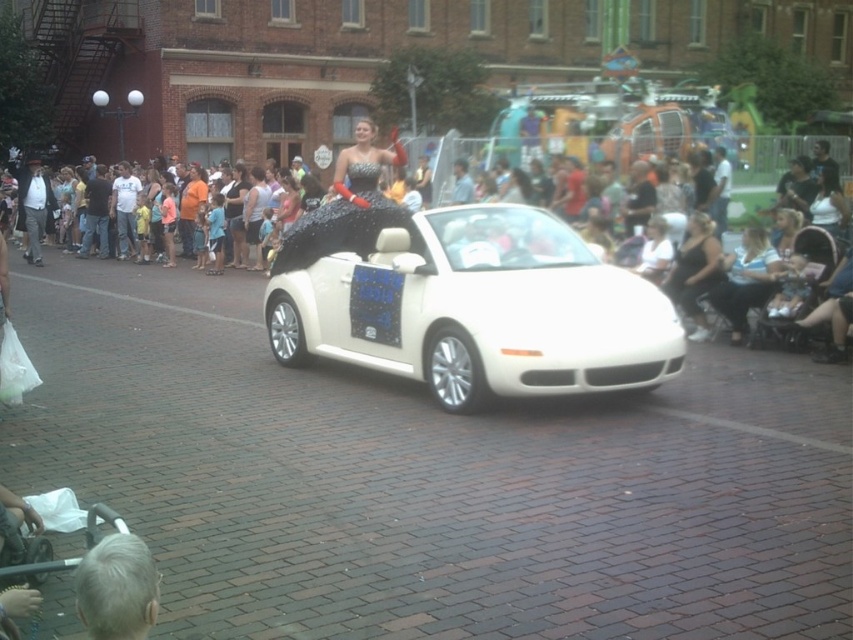
Between point (512, 294) and point (115, 600), which one is positioned behind?

The point (512, 294) is more distant.

The width and height of the screenshot is (853, 640). Find the location of `white glossy convertible at center`. white glossy convertible at center is located at coordinates (473, 307).

Between point (433, 228) and point (97, 561), which one is positioned behind?

Point (433, 228)

Identify the location of matte black dress at center. This screenshot has height=640, width=853. (469, 273).

Does point (405, 353) lie behind point (375, 324)?

That is False.

Which is behind, point (384, 262) or point (322, 291)?

The point (322, 291) is behind.

Locate an element on the screen. The width and height of the screenshot is (853, 640). white glossy convertible at center is located at coordinates (473, 307).